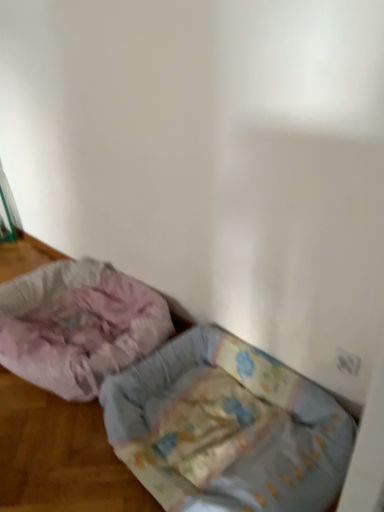
Question: Can you confirm if fluffy pink fabric dog bed at lower left, the 1th dog bed viewed from the left, is thinner than fluffy fabric dog bed at lower left, positioned as the first dog bed in right-to-left order?

Choices:
 (A) yes
 (B) no

Answer: (B)

Question: Is fluffy pink fabric dog bed at lower left, placed as the 2th dog bed when sorted from right to left, facing away from fluffy fabric dog bed at lower left, the 2th dog bed when ordered from left to right?

Choices:
 (A) no
 (B) yes

Answer: (A)

Question: From the image's perspective, is fluffy pink fabric dog bed at lower left, placed as the 2th dog bed when sorted from right to left, below fluffy fabric dog bed at lower left, the 2th dog bed when ordered from left to right?

Choices:
 (A) no
 (B) yes

Answer: (A)

Question: Is fluffy pink fabric dog bed at lower left, the 1th dog bed viewed from the left, wider than fluffy fabric dog bed at lower left, positioned as the first dog bed in right-to-left order?

Choices:
 (A) no
 (B) yes

Answer: (B)

Question: Is fluffy pink fabric dog bed at lower left, placed as the 2th dog bed when sorted from right to left, bigger than fluffy fabric dog bed at lower left, the 2th dog bed when ordered from left to right?

Choices:
 (A) no
 (B) yes

Answer: (B)

Question: From a real-world perspective, is fluffy pink fabric dog bed at lower left, placed as the 2th dog bed when sorted from right to left, located beneath fluffy fabric dog bed at lower left, the 2th dog bed when ordered from left to right?

Choices:
 (A) yes
 (B) no

Answer: (B)

Question: Is fluffy pink fabric dog bed at lower left, placed as the 2th dog bed when sorted from right to left, a part of fluffy fabric dog bed at lower left, positioned as the first dog bed in right-to-left order?

Choices:
 (A) yes
 (B) no

Answer: (B)

Question: Is fluffy fabric dog bed at lower left, the 2th dog bed when ordered from left to right, to the left of fluffy pink fabric dog bed at lower left, placed as the 2th dog bed when sorted from right to left, from the viewer's perspective?

Choices:
 (A) yes
 (B) no

Answer: (B)

Question: Is fluffy fabric dog bed at lower left, positioned as the first dog bed in right-to-left order, outside of fluffy pink fabric dog bed at lower left, placed as the 2th dog bed when sorted from right to left?

Choices:
 (A) yes
 (B) no

Answer: (A)

Question: From the image's perspective, is fluffy fabric dog bed at lower left, positioned as the first dog bed in right-to-left order, on top of fluffy pink fabric dog bed at lower left, placed as the 2th dog bed when sorted from right to left?

Choices:
 (A) yes
 (B) no

Answer: (B)

Question: Does fluffy fabric dog bed at lower left, the 2th dog bed when ordered from left to right, have a smaller size compared to fluffy pink fabric dog bed at lower left, the 1th dog bed viewed from the left?

Choices:
 (A) no
 (B) yes

Answer: (B)

Question: Is fluffy fabric dog bed at lower left, positioned as the first dog bed in right-to-left order, taller than fluffy pink fabric dog bed at lower left, the 1th dog bed viewed from the left?

Choices:
 (A) yes
 (B) no

Answer: (B)

Question: From the image's perspective, relative to fluffy fabric dog bed at lower left, the 2th dog bed when ordered from left to right, is fluffy pink fabric dog bed at lower left, placed as the 2th dog bed when sorted from right to left, above or below?

Choices:
 (A) below
 (B) above

Answer: (B)